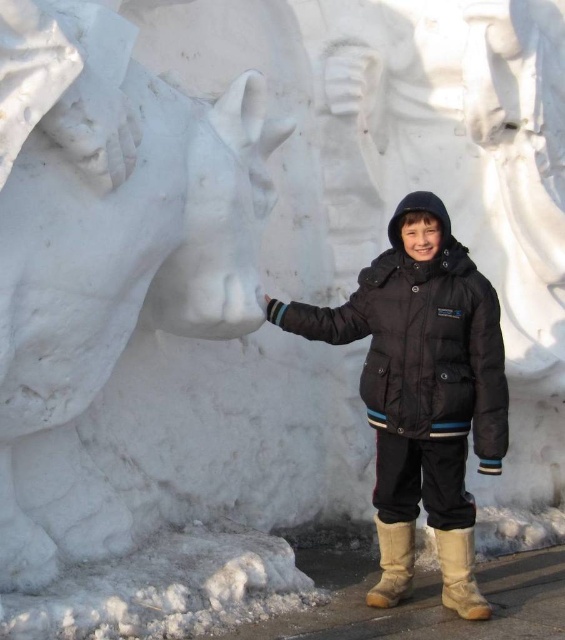
How distant is leather at lower right from brown suede boot at lower center?

They are 18.71 centimeters apart.

Does leather at lower right have a greater height compared to brown suede boot at lower center?

In fact, leather at lower right may be shorter than brown suede boot at lower center.

You are a GUI agent. You are given a task and a screenshot of the screen. Output one action in this format:
    pyautogui.click(x=<x>, y=<y>)
    Task: Click on the leather at lower right
    This screenshot has width=565, height=640.
    Given the screenshot: What is the action you would take?
    pyautogui.click(x=459, y=573)

Identify the location of leather at lower right. The width and height of the screenshot is (565, 640). (459, 573).

Based on the photo, who is more distant from viewer, [405,216] or [452,540]?

Positioned behind is point [405,216].

How distant is black matte jacket at center from leather at lower right?

black matte jacket at center is 14.16 inches away from leather at lower right.

Is point (450, 458) positioned in front of point (446, 589)?

Yes, it is.

Image resolution: width=565 pixels, height=640 pixels. Identify the location of black matte jacket at center. (423, 380).

Which of these two, black matte jacket at center or brown suede boot at lower center, stands taller?

black matte jacket at center is taller.

Which is above, black matte jacket at center or brown suede boot at lower center?

black matte jacket at center is higher up.

Image resolution: width=565 pixels, height=640 pixels. What do you see at coordinates (423, 380) in the screenshot? I see `black matte jacket at center` at bounding box center [423, 380].

Image resolution: width=565 pixels, height=640 pixels. Identify the location of black matte jacket at center. (x=423, y=380).